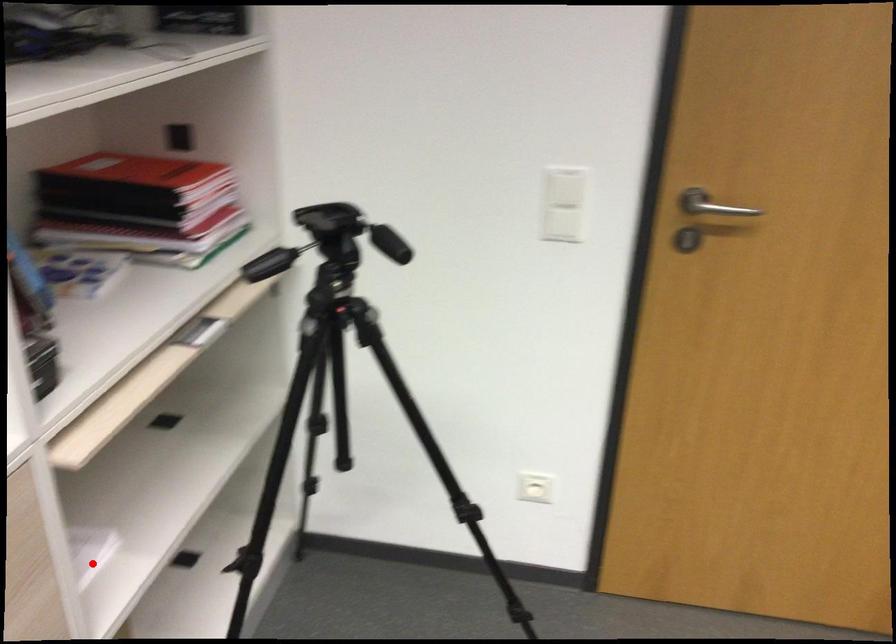
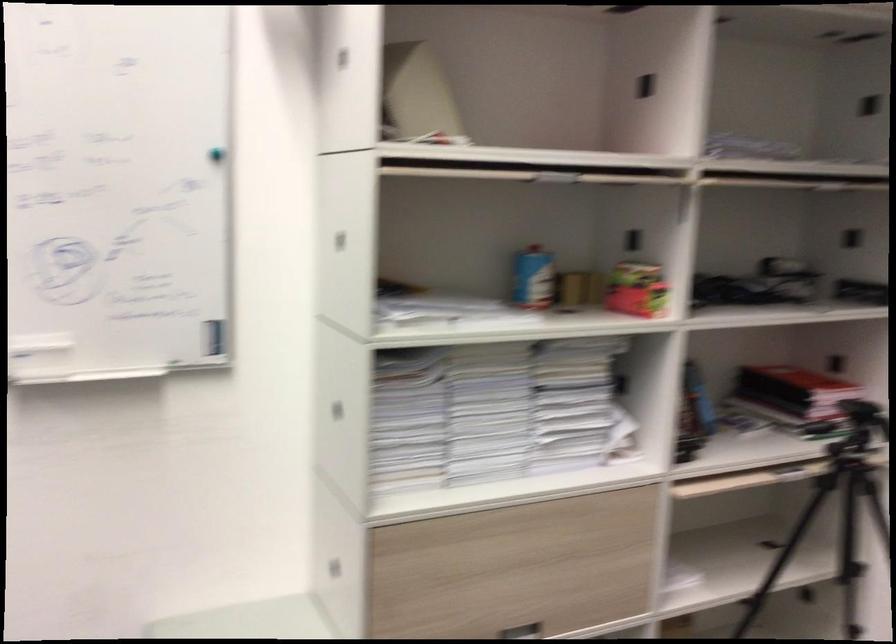
The point at the highlighted location is marked in the first image. Where is the corresponding point in the second image?

(678, 581)